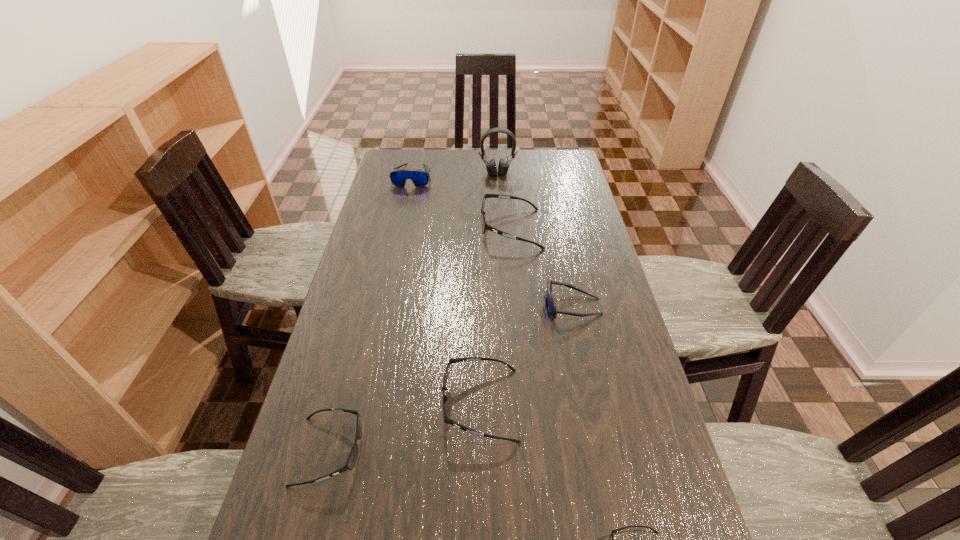
The image size is (960, 540). In order to click on headset in this screenshot , I will do `click(503, 166)`.

Where is `the farthest gray sunglasses`? the farthest gray sunglasses is located at coordinates (484, 226).

This screenshot has height=540, width=960. I want to click on the second farthest sunglasses, so click(484, 226).

Find the location of a particular element. the bigger blue sunglasses is located at coordinates 420,178.

This screenshot has height=540, width=960. Identify the location of the farthest sunglasses. (420, 178).

Where is `the second biggest gray sunglasses`? Image resolution: width=960 pixels, height=540 pixels. the second biggest gray sunglasses is located at coordinates (444, 398).

Where is `the fourth nearest sunglasses`? The height and width of the screenshot is (540, 960). the fourth nearest sunglasses is located at coordinates (550, 305).

Where is `the nearer blue sunglasses`? Image resolution: width=960 pixels, height=540 pixels. the nearer blue sunglasses is located at coordinates (550, 305).

This screenshot has width=960, height=540. I want to click on the leftmost gray sunglasses, so point(351,461).

Find the location of `vacant region located on the front-facing side of the headset`. vacant region located on the front-facing side of the headset is located at coordinates (499, 208).